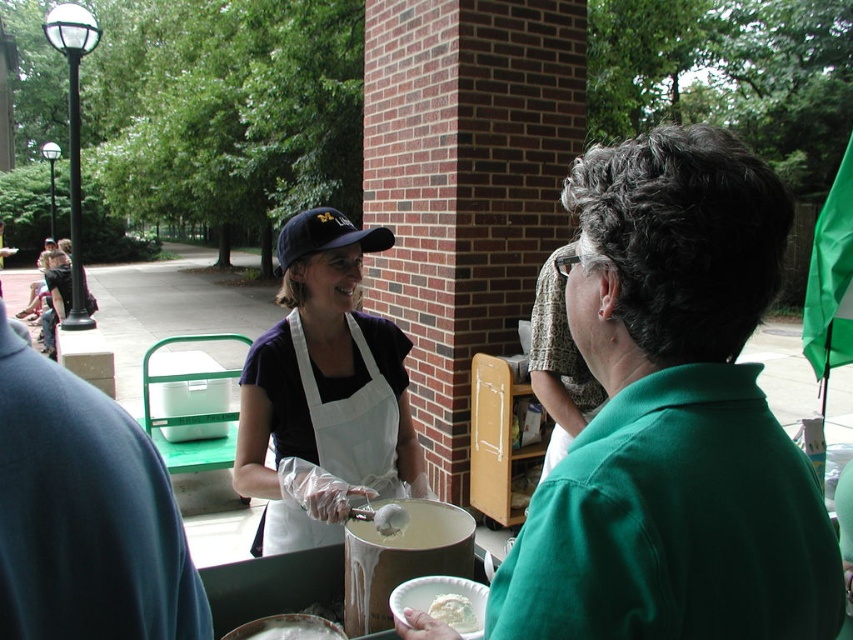
What are the coordinates of the dark blue fabric baseball cap at center?

The dark blue fabric baseball cap at center is located at point (323,236).

You are a customer at an ice cream stand. You notice the dark blue fabric baseball cap at center and the white matte paper plate at center. Which object is taller?

The dark blue fabric baseball cap at center is much taller than the white matte paper plate at center.

You are a photographer standing at a certain distance from the woman. You want to take a photo of the scene such that the point at point (3, 632) is clearly visible. Given that your camera has a minimum focus distance of 20 inches, will you need to adjust your position to ensure the point is in focus?

The distance of point (3, 632) from the camera is 22.55 inches, which is greater than the camera minimum focus distance of 20 inches. Therefore, you do not need to adjust your position to ensure the point is in focus.